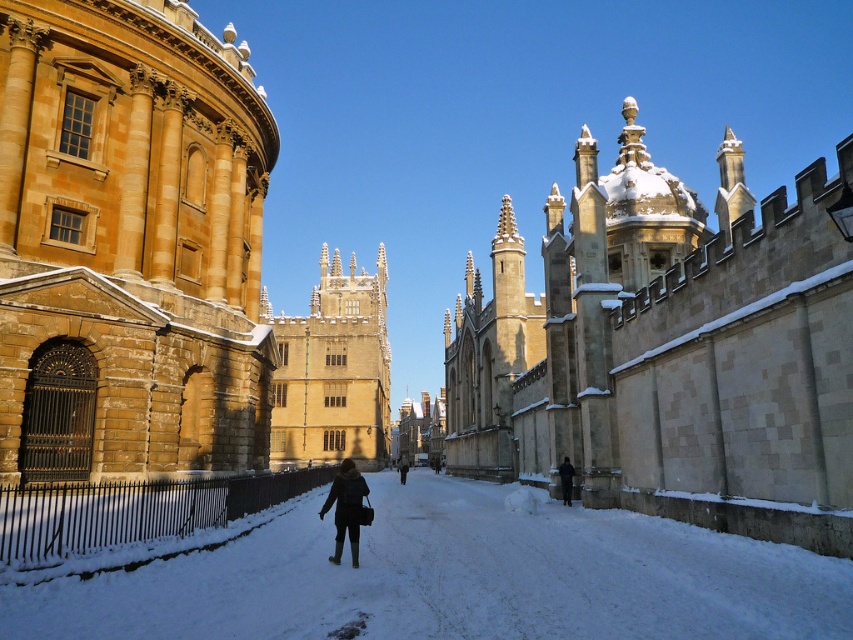
Does white powdery snow at center appear on the left side of dark gray coat at center?

In fact, white powdery snow at center is to the right of dark gray coat at center.

Can you confirm if white powdery snow at center is positioned above dark gray coat at center?

Correct, white powdery snow at center is located above dark gray coat at center.

The width and height of the screenshot is (853, 640). What do you see at coordinates (456, 577) in the screenshot? I see `white powdery snow at center` at bounding box center [456, 577].

Where is `white powdery snow at center`? Image resolution: width=853 pixels, height=640 pixels. white powdery snow at center is located at coordinates (456, 577).

Which is more to the right, dark brown leather jacket at center or dark gray coat at center?

dark gray coat at center

In the scene shown: Can you confirm if dark brown leather jacket at center is wider than dark gray coat at center?

Yes, dark brown leather jacket at center is wider than dark gray coat at center.

Does point (349, 515) lie behind point (399, 465)?

No, (349, 515) is in front of (399, 465).

Where is `dark brown leather jacket at center`? The width and height of the screenshot is (853, 640). dark brown leather jacket at center is located at coordinates (345, 508).

Between point (184, 22) and point (289, 369), which one is positioned in front?

Point (184, 22) is more forward.

Does golden stone building at left appear on the right side of yellow stone building at center?

Yes, golden stone building at left is to the right of yellow stone building at center.

Which is behind, point (160, 132) or point (340, 301)?

Point (340, 301)

Find the location of a particular element. The image size is (853, 640). golden stone building at left is located at coordinates (129, 243).